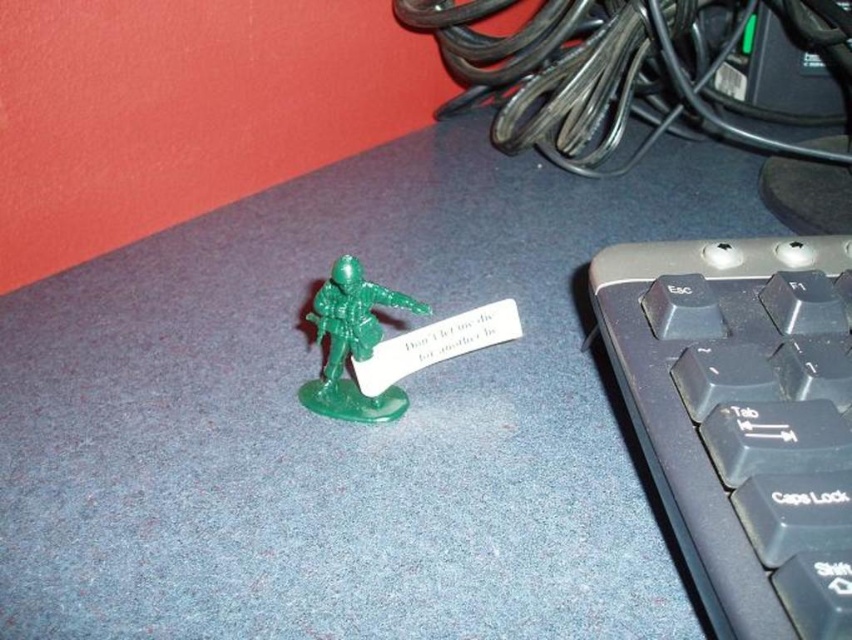
You are a person who wants to place a small toy on the desk between the black plastic keyboard at right and the green plastic toy soldier at center. Which object should you move to make space?

The black plastic keyboard at right is much taller than the green plastic toy soldier at center, so you should move the black plastic keyboard at right to make space for the new toy.

You are a person sitting at a desk. You want to reach for the black plastic keyboard at right without moving your chair. Can you reach it while keeping your hand on the green plastic toy soldier at center?

The black plastic keyboard at right is in front of the green plastic toy soldier at center, so if your hand is on the green plastic toy soldier at center, you can extend your arm forward to reach the black plastic keyboard at right without moving your chair.

You are organizing items on your desk and see the black plastic keyboard at right and the green plastic toy soldier at center. Which item is positioned more to the right side of the desk?

The black plastic keyboard at right is positioned more to the right side of the desk than the green plastic toy soldier at center because it is located to the right of it.